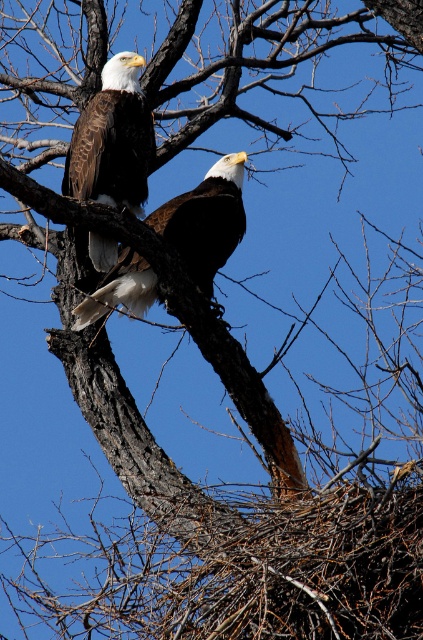
Question: Considering the relative positions of brown feathered eagle at upper left and white-feathered bald eagle at center in the image provided, where is brown feathered eagle at upper left located with respect to white-feathered bald eagle at center?

Choices:
 (A) above
 (B) below

Answer: (A)

Question: Does brown feathered eagle at upper left appear over white-feathered bald eagle at center?

Choices:
 (A) no
 (B) yes

Answer: (B)

Question: Which point appears farthest from the camera in this image?

Choices:
 (A) (87, 305)
 (B) (80, 182)

Answer: (B)

Question: Does brown feathered eagle at upper left have a smaller size compared to white-feathered bald eagle at center?

Choices:
 (A) no
 (B) yes

Answer: (A)